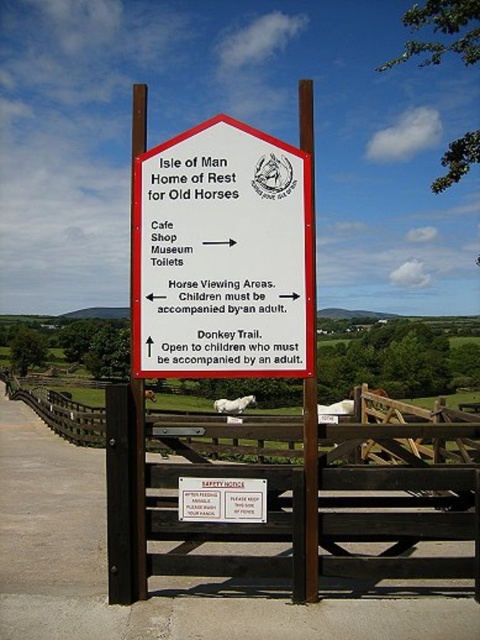
Question: Which point is farther to the camera?

Choices:
 (A) (155, 360)
 (B) (313, 589)
 (C) (386, 616)

Answer: (A)

Question: Can you confirm if white paper sign at center is positioned above white plastic sign at center?

Choices:
 (A) yes
 (B) no

Answer: (A)

Question: Does white paper sign at center have a lesser width compared to wooden fence at center?

Choices:
 (A) yes
 (B) no

Answer: (A)

Question: Based on their relative distances, which object is nearer to the wooden fence at center?

Choices:
 (A) white plastic sign at center
 (B) white wood post at center
 (C) white paper sign at center

Answer: (A)

Question: Which object appears farthest from the camera in this image?

Choices:
 (A) white wood post at center
 (B) wooden fence at center
 (C) white paper sign at center
 (D) white plastic sign at center

Answer: (D)

Question: Is white wood post at center to the right of white plastic sign at center from the viewer's perspective?

Choices:
 (A) yes
 (B) no

Answer: (A)